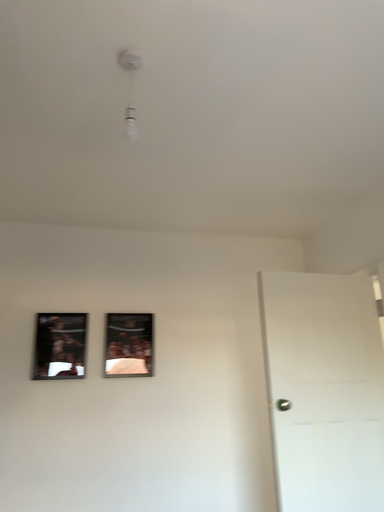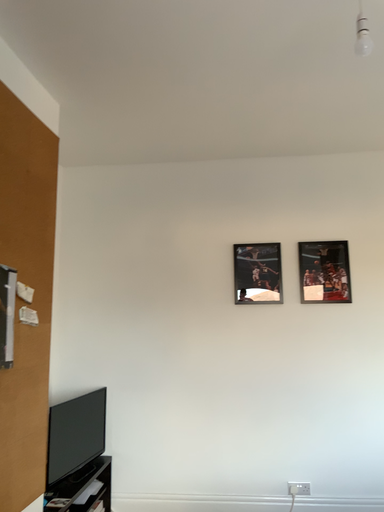
Question: How did the camera likely rotate when shooting the video?

Choices:
 (A) rotated downward
 (B) rotated upward

Answer: (A)